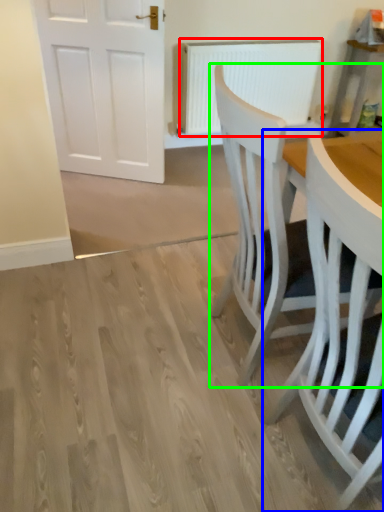
Question: Estimate the real-world distances between objects in this image. Which object is farther from radiator (highlighted by a red box), chair (highlighted by a blue box) or chair (highlighted by a green box)?

Choices:
 (A) chair
 (B) chair

Answer: (A)